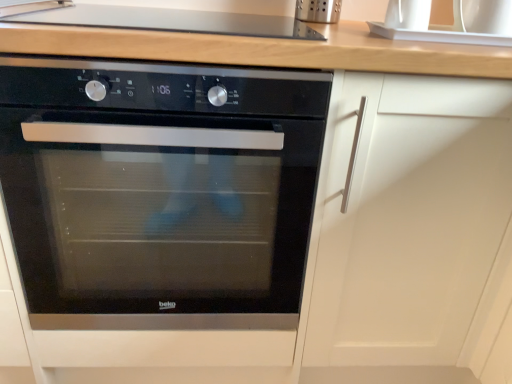
Question: Is white glossy sink at upper right located within black glass oven at center?

Choices:
 (A) yes
 (B) no

Answer: (B)

Question: Considering the relative sizes of black glass oven at center and white glossy sink at upper right in the image provided, is black glass oven at center wider than white glossy sink at upper right?

Choices:
 (A) yes
 (B) no

Answer: (A)

Question: From the image's perspective, would you say black glass oven at center is positioned over white glossy sink at upper right?

Choices:
 (A) no
 (B) yes

Answer: (A)

Question: Can you confirm if black glass oven at center is smaller than white glossy sink at upper right?

Choices:
 (A) yes
 (B) no

Answer: (B)

Question: Can you confirm if black glass oven at center is positioned to the left of white glossy sink at upper right?

Choices:
 (A) yes
 (B) no

Answer: (A)

Question: From a real-world perspective, is black glass oven at center above or below smooth glass cooktop at upper center?

Choices:
 (A) below
 (B) above

Answer: (A)

Question: Is point (287, 132) closer or farther from the camera than point (75, 8)?

Choices:
 (A) closer
 (B) farther

Answer: (A)

Question: Choose the correct answer: Is black glass oven at center inside smooth glass cooktop at upper center or outside it?

Choices:
 (A) inside
 (B) outside

Answer: (B)

Question: Is black glass oven at center to the left or to the right of smooth glass cooktop at upper center in the image?

Choices:
 (A) left
 (B) right

Answer: (A)

Question: Would you say white glossy sink at upper right is inside or outside black glass oven at center?

Choices:
 (A) inside
 (B) outside

Answer: (B)

Question: Looking at the image, does white glossy sink at upper right seem bigger or smaller compared to black glass oven at center?

Choices:
 (A) small
 (B) big

Answer: (A)

Question: Would you say white glossy sink at upper right is to the left or to the right of black glass oven at center in the picture?

Choices:
 (A) right
 (B) left

Answer: (A)

Question: Considering the positions of point (492, 6) and point (79, 279), is point (492, 6) closer or farther from the camera than point (79, 279)?

Choices:
 (A) closer
 (B) farther

Answer: (A)

Question: Is black glass oven at center inside or outside of white glossy sink at upper right?

Choices:
 (A) inside
 (B) outside

Answer: (B)

Question: From the image's perspective, is black glass oven at center located above or below white glossy sink at upper right?

Choices:
 (A) above
 (B) below

Answer: (B)